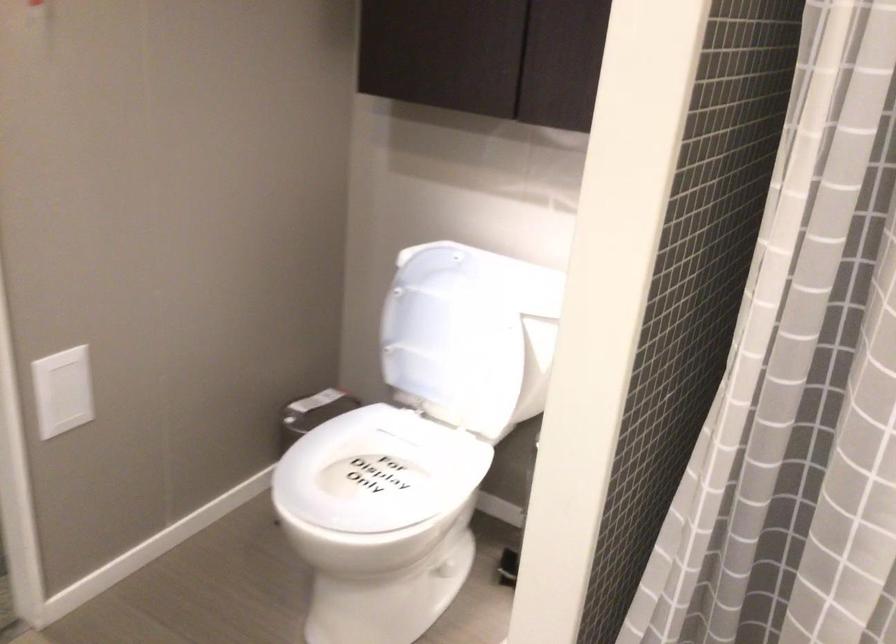
Where would you lower the white toilet lid? Please return your answer as a coordinate pair (x, y).

(477, 279)